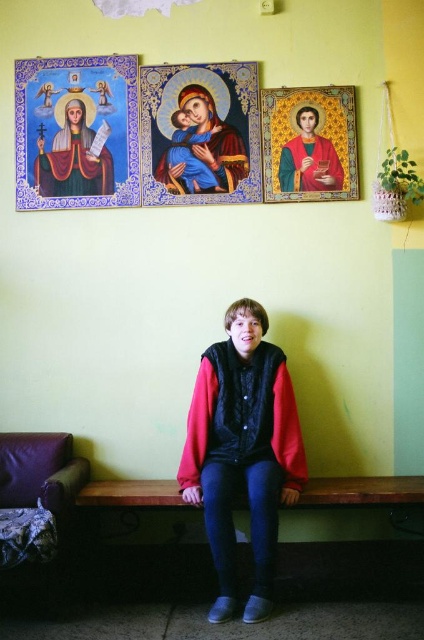
Consider the image. Does matte blue fabric at center lie behind matte gold icon at upper left?

That is False.

Who is positioned more to the left, matte blue fabric at center or matte gold icon at upper left?

matte gold icon at upper left is more to the left.

At what (x,y) coordinates should I click in order to perform the action: click on matte blue fabric at center. Please return your answer as a coordinate pair (x, y). The image size is (424, 640). Looking at the image, I should click on (201, 147).

Which of these two, red fleece jacket at center or matte gold icon at upper left, stands shorter?

Standing shorter between the two is matte gold icon at upper left.

Describe the element at coordinates (242, 451) in the screenshot. The image size is (424, 640). I see `red fleece jacket at center` at that location.

Identify the location of red fleece jacket at center. The image size is (424, 640). (242, 451).

In the scene shown: Does matte gold icon at upper left appear on the left side of gold textured icon at upper center?

Yes, matte gold icon at upper left is to the left of gold textured icon at upper center.

Does point (66, 136) come closer to viewer compared to point (332, 147)?

No, (66, 136) is further to viewer.

Find the location of a particular element. This screenshot has width=424, height=640. matte gold icon at upper left is located at coordinates (72, 160).

You are a GUI agent. You are given a task and a screenshot of the screen. Output one action in this format:
    pyautogui.click(x=<x>, y=<y>)
    Task: Click on the matte gold icon at upper left
    This screenshot has height=640, width=424.
    Given the screenshot: What is the action you would take?
    pyautogui.click(x=72, y=160)